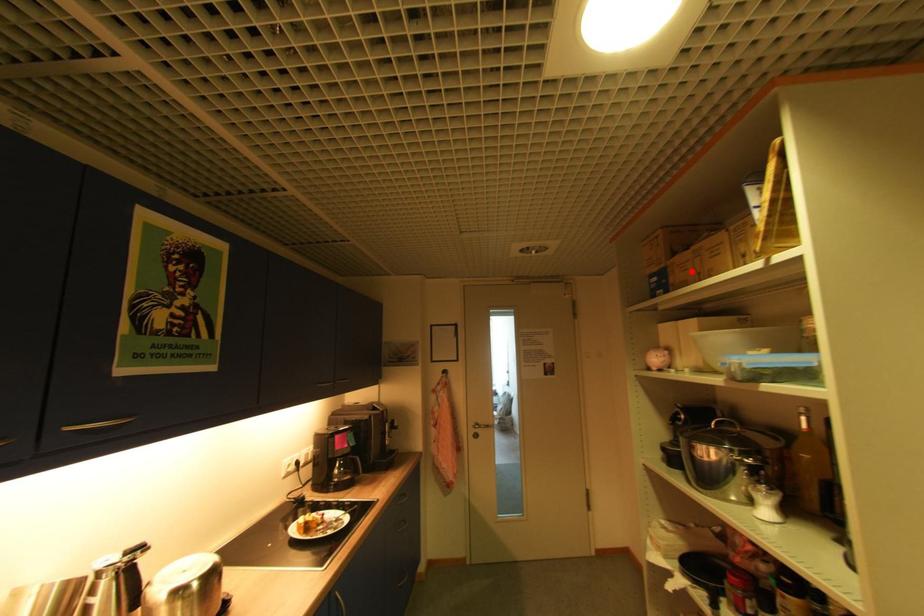
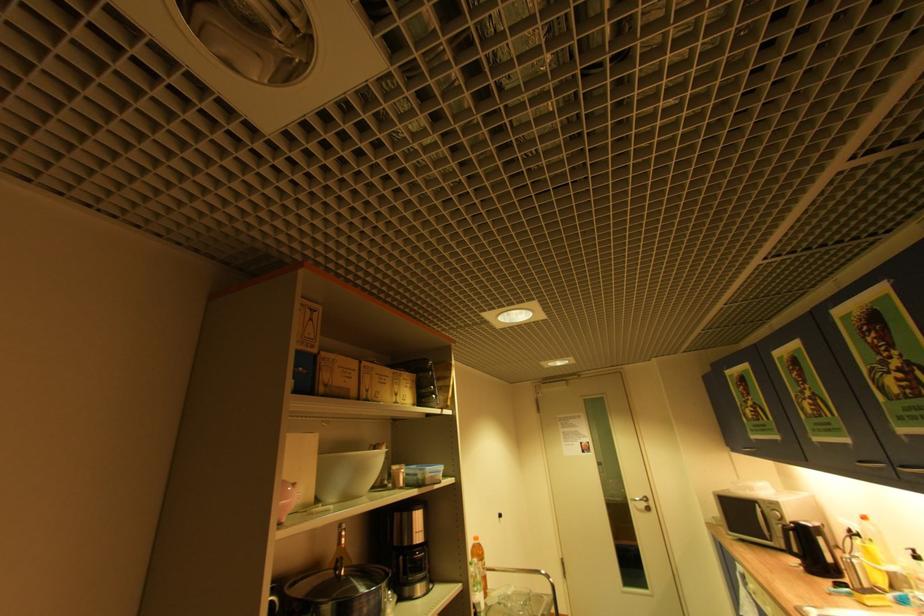
Where in the second image is the point corresponding to the highlighted location from the first image?

(357, 379)